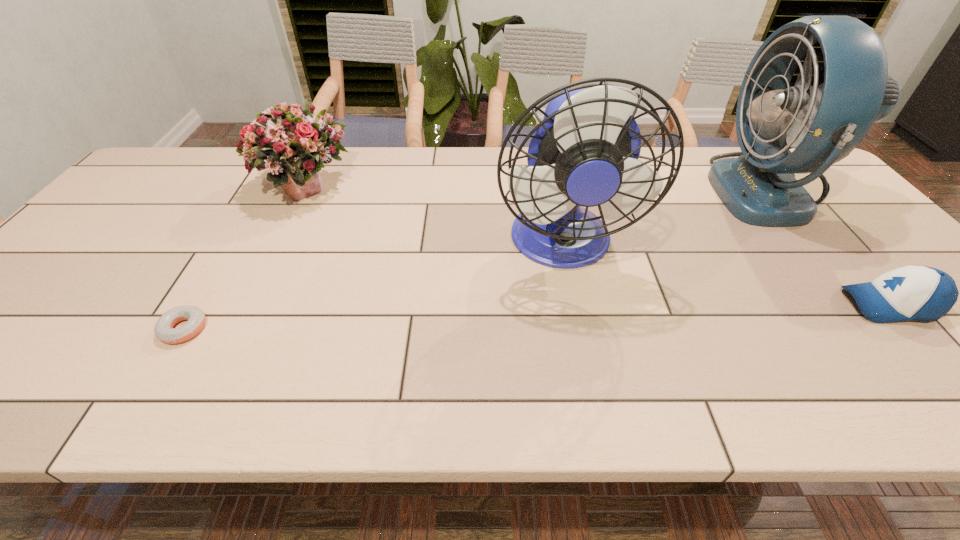
Image resolution: width=960 pixels, height=540 pixels. In the image, there is a desktop. What are the coordinates of `vacant area at the near edge` in the screenshot? It's located at (718, 397).

What are the coordinates of `vacant space at the left edge of the desktop` in the screenshot? It's located at (136, 234).

You are a GUI agent. You are given a task and a screenshot of the screen. Output one action in this format:
    pyautogui.click(x=<x>, y=<y>)
    Task: Click on the vacant area at the right edge
    The height and width of the screenshot is (540, 960).
    Given the screenshot: What is the action you would take?
    pyautogui.click(x=881, y=262)

You are a GUI agent. You are given a task and a screenshot of the screen. Output one action in this format:
    pyautogui.click(x=<x>, y=<y>)
    Task: Click on the unoccupied area between the shortest object and the baseball cap
    The image size is (960, 540).
    Given the screenshot: What is the action you would take?
    pyautogui.click(x=537, y=316)

Find the location of `vacant area between the left fan and the bouquet`. vacant area between the left fan and the bouquet is located at coordinates (433, 217).

Find the location of a particular element. Image resolution: width=960 pixels, height=540 pixels. free space between the fourth tallest object and the doughnut is located at coordinates (537, 316).

Where is `free space between the third object from left to right and the shortest object`? The image size is (960, 540). free space between the third object from left to right and the shortest object is located at coordinates (372, 286).

At what (x,y) coordinates should I click in order to perform the action: click on empty space between the right fan and the doughnut. Please return your answer as a coordinate pair (x, y). The width and height of the screenshot is (960, 540). Looking at the image, I should click on (476, 260).

Find the location of `empty location between the right fan and the baseball cap`. empty location between the right fan and the baseball cap is located at coordinates (828, 247).

Identify the location of vacant space in between the shortest object and the left fan. The image size is (960, 540). (372, 286).